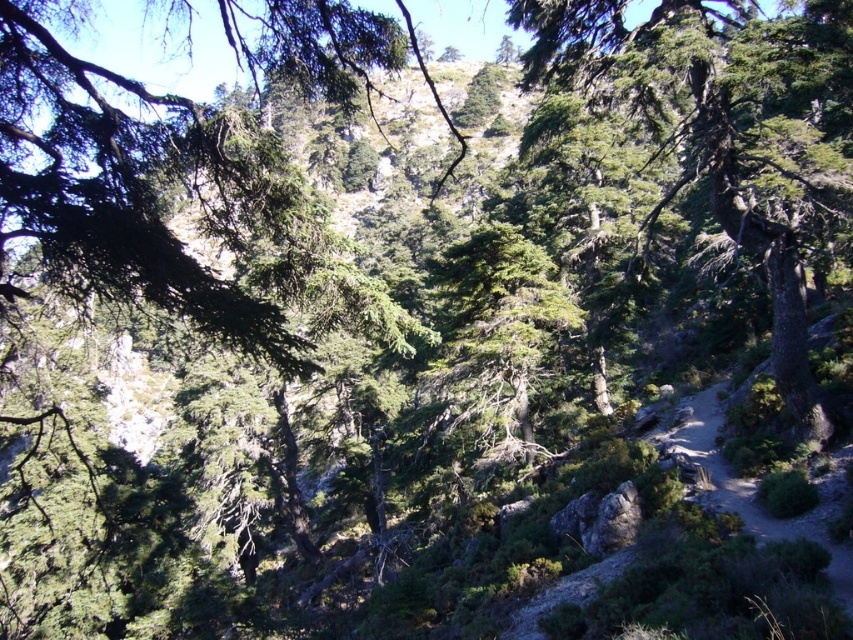
Question: Can you confirm if green needle-like leaves at upper left is positioned to the right of green rough bark tree at center?

Choices:
 (A) no
 (B) yes

Answer: (A)

Question: Which of the following is the closest to the observer?

Choices:
 (A) green rough bark tree at center
 (B) green needle-like leaves at upper left

Answer: (B)

Question: Is green needle-like leaves at upper left thinner than green rough bark tree at center?

Choices:
 (A) yes
 (B) no

Answer: (B)

Question: Which object is closer to the camera taking this photo?

Choices:
 (A) green needle-like leaves at upper left
 (B) green rough bark tree at center

Answer: (A)

Question: Is green needle-like leaves at upper left bigger than green rough bark tree at center?

Choices:
 (A) yes
 (B) no

Answer: (A)

Question: Which object appears closest to the camera in this image?

Choices:
 (A) green rough bark tree at center
 (B) green needle-like leaves at upper left

Answer: (B)